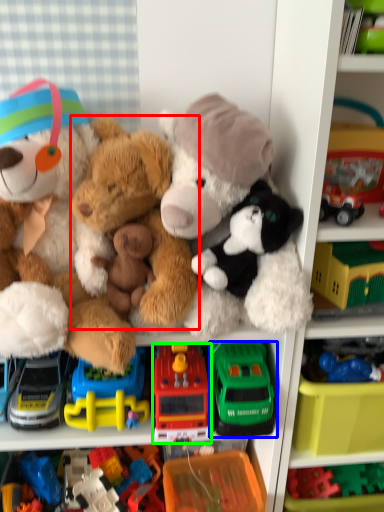
Question: Based on their relative distances, which object is farther from teddy bear (highlighted by a red box)? Choose from toy (highlighted by a blue box) and toy (highlighted by a green box).

Choices:
 (A) toy
 (B) toy

Answer: (A)